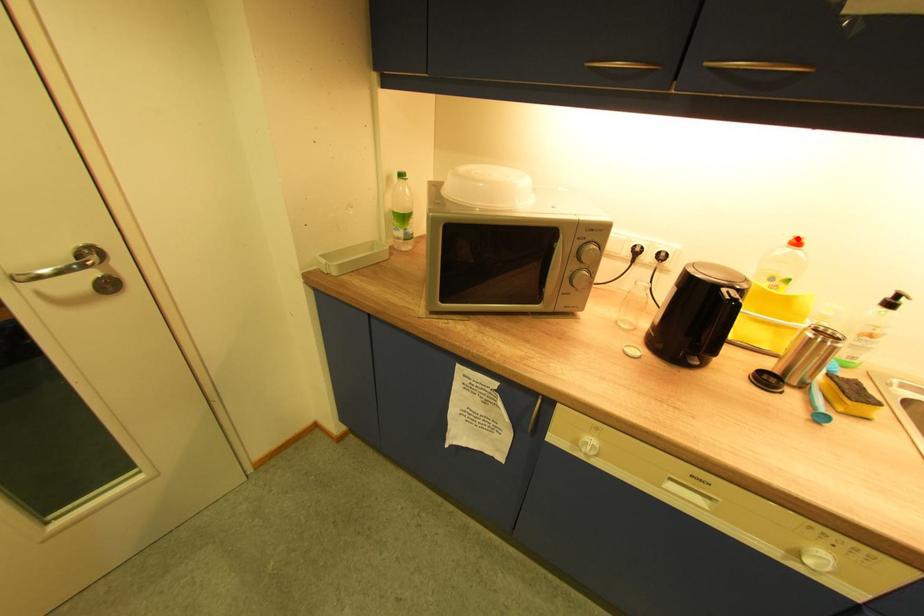
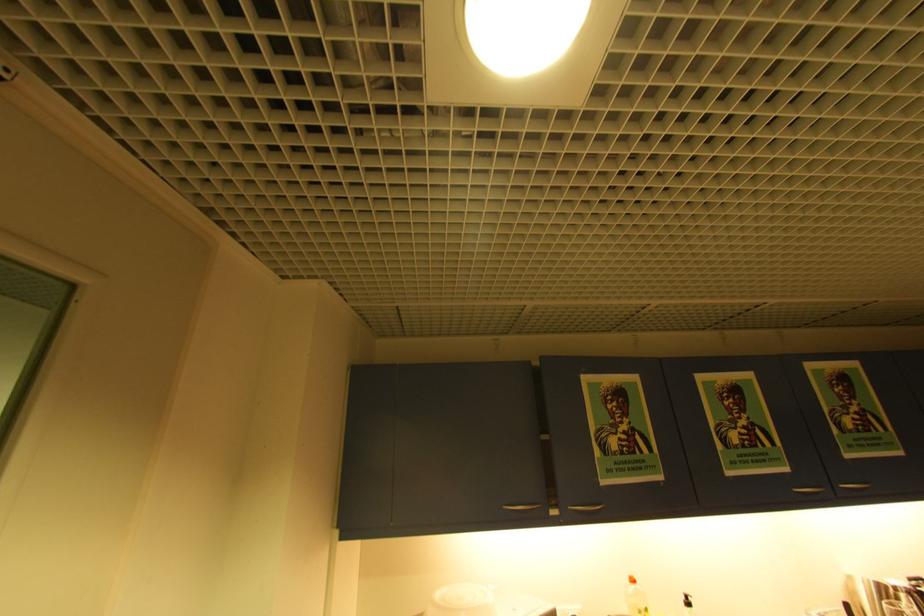
The point at the highlighted location is marked in the first image. Where is the corresponding point in the second image?

(634, 578)